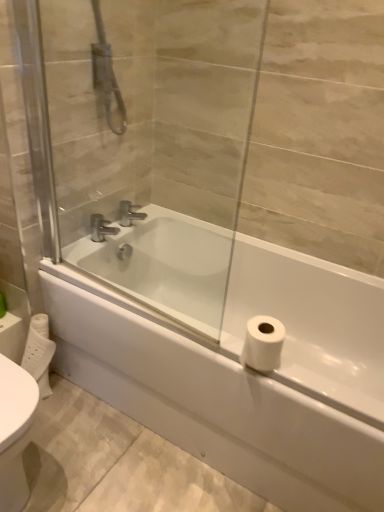
Describe the element at coordinates (231, 355) in the screenshot. I see `white glossy bathtub at center` at that location.

This screenshot has width=384, height=512. What do you see at coordinates (129, 213) in the screenshot? I see `chrome metallic faucet at upper center, which appears as the second tap when viewed from the left` at bounding box center [129, 213].

I want to click on silver metallic faucet at center, the 2th tap from the right, so point(101,228).

Identify the location of white glossy bathtub at center. (231, 355).

Can you tell me how much chrome metallic faucet at upper center, which is the first tap from right to left, and silver metallic faucet at center, marked as the 1th tap in a left-to-right arrangement, differ in facing direction?

The angle between the facing direction of chrome metallic faucet at upper center, which is the first tap from right to left, and the facing direction of silver metallic faucet at center, marked as the 1th tap in a left-to-right arrangement, is 0.00452 degrees.

Is silver metallic faucet at center, marked as the 1th tap in a left-to-right arrangement, at the back of chrome metallic faucet at upper center, which appears as the second tap when viewed from the left?

No, chrome metallic faucet at upper center, which appears as the second tap when viewed from the left,'s orientation is not away from silver metallic faucet at center, marked as the 1th tap in a left-to-right arrangement.

Between point (146, 215) and point (95, 225), which one is positioned in front?

The point (95, 225) is closer.

In the image, is chrome metallic faucet at upper center, which appears as the second tap when viewed from the left, positioned in front of or behind silver metallic faucet at center, the 2th tap from the right?

Clearly, chrome metallic faucet at upper center, which appears as the second tap when viewed from the left, is behind silver metallic faucet at center, the 2th tap from the right.

From the picture: Is silver metallic faucet at center, marked as the 1th tap in a left-to-right arrangement, at the back of transparent glass screen door at upper center?

Yes.

Which is less distant, (169, 76) or (96, 216)?

The point (169, 76) is more forward.

At what (x,y) coordinates should I click in order to perform the action: click on the 2nd tap located beneath the transparent glass screen door at upper center (from a real-world perspective). Please return your answer as a coordinate pair (x, y). The image size is (384, 512). Looking at the image, I should click on (101, 228).

Which object is positioned more to the right, transparent glass screen door at upper center or chrome metallic faucet at upper center, which appears as the second tap when viewed from the left?

transparent glass screen door at upper center.

From the image's perspective, which is above, transparent glass screen door at upper center or chrome metallic faucet at upper center, which appears as the second tap when viewed from the left?

From the image's view, transparent glass screen door at upper center is above.

Do you think transparent glass screen door at upper center is within chrome metallic faucet at upper center, which appears as the second tap when viewed from the left, or outside of it?

transparent glass screen door at upper center is outside chrome metallic faucet at upper center, which appears as the second tap when viewed from the left.

Can you confirm if transparent glass screen door at upper center is thinner than chrome metallic faucet at upper center, which is the first tap from right to left?

Yes, transparent glass screen door at upper center is thinner than chrome metallic faucet at upper center, which is the first tap from right to left.

Between point (302, 344) and point (211, 229), which one is positioned behind?

Point (211, 229)

Could you tell me if white glossy bathtub at center is facing transparent glass screen door at upper center?

No.

The height and width of the screenshot is (512, 384). In the image, there is a transparent glass screen door at upper center. In order to click on bathtub below it (from the image's perspective) in this screenshot , I will do `click(231, 355)`.

Considering the positions of objects chrome metallic faucet at upper center, which appears as the second tap when viewed from the left, and white glossy bathtub at center in the image provided, who is more to the right, chrome metallic faucet at upper center, which appears as the second tap when viewed from the left, or white glossy bathtub at center?

white glossy bathtub at center.

Considering the relative sizes of chrome metallic faucet at upper center, which is the first tap from right to left, and white glossy bathtub at center in the image provided, is chrome metallic faucet at upper center, which is the first tap from right to left, bigger than white glossy bathtub at center?

Actually, chrome metallic faucet at upper center, which is the first tap from right to left, might be smaller than white glossy bathtub at center.

Is chrome metallic faucet at upper center, which is the first tap from right to left, wider or thinner than white glossy bathtub at center?

Considering their sizes, chrome metallic faucet at upper center, which is the first tap from right to left, looks slimmer than white glossy bathtub at center.

Is point (135, 218) positioned before point (313, 370)?

That is False.

From the image's perspective, who appears lower, white glossy bathtub at center or chrome metallic faucet at upper center, which is the first tap from right to left?

white glossy bathtub at center.

Find the location of a particular element. The height and width of the screenshot is (512, 384). the 2nd tap above the white glossy bathtub at center (from the image's perspective) is located at coordinates (129, 213).

Does point (83, 282) appear closer or farther from the camera than point (128, 223)?

Clearly, point (83, 282) is closer to the camera than point (128, 223).

Which is behind, point (99, 234) or point (124, 223)?

Positioned behind is point (124, 223).

How far apart are silver metallic faucet at center, marked as the 1th tap in a left-to-right arrangement, and chrome metallic faucet at upper center, which is the first tap from right to left?

silver metallic faucet at center, marked as the 1th tap in a left-to-right arrangement, is 10.36 centimeters from chrome metallic faucet at upper center, which is the first tap from right to left.

Is silver metallic faucet at center, the 2th tap from the right, with chrome metallic faucet at upper center, which is the first tap from right to left?

They are not placed beside each other.

What's the angular difference between silver metallic faucet at center, the 2th tap from the right, and chrome metallic faucet at upper center, which is the first tap from right to left,'s facing directions?

0.00452 degrees.

Where is `tap that is above the silver metallic faucet at center, the 2th tap from the right (from the image's perspective)`? tap that is above the silver metallic faucet at center, the 2th tap from the right (from the image's perspective) is located at coordinates click(x=129, y=213).

This screenshot has height=512, width=384. I want to click on screen door above the silver metallic faucet at center, the 2th tap from the right (from a real-world perspective), so click(x=154, y=141).

When comparing their distances from transparent glass screen door at upper center, does chrome metallic faucet at upper center, which is the first tap from right to left, or white glossy bathtub at center seem further?

Among the two, chrome metallic faucet at upper center, which is the first tap from right to left, is located further to transparent glass screen door at upper center.

Based on their spatial positions, is silver metallic faucet at center, the 2th tap from the right, or chrome metallic faucet at upper center, which appears as the second tap when viewed from the left, further from white glossy bathtub at center?

chrome metallic faucet at upper center, which appears as the second tap when viewed from the left, is positioned further to the anchor white glossy bathtub at center.

Based on their spatial positions, is chrome metallic faucet at upper center, which is the first tap from right to left, or transparent glass screen door at upper center closer to white glossy bathtub at center?

The object closer to white glossy bathtub at center is transparent glass screen door at upper center.

Based on the photo, based on their spatial positions, is silver metallic faucet at center, marked as the 1th tap in a left-to-right arrangement, or transparent glass screen door at upper center further from chrome metallic faucet at upper center, which is the first tap from right to left?

transparent glass screen door at upper center lies further to chrome metallic faucet at upper center, which is the first tap from right to left, than the other object.

Looking at the image, which one is located further to silver metallic faucet at center, marked as the 1th tap in a left-to-right arrangement, transparent glass screen door at upper center or chrome metallic faucet at upper center, which appears as the second tap when viewed from the left?

transparent glass screen door at upper center lies further to silver metallic faucet at center, marked as the 1th tap in a left-to-right arrangement, than the other object.

From the image, which object appears to be farther from transparent glass screen door at upper center, silver metallic faucet at center, the 2th tap from the right, or white glossy bathtub at center?

Based on the image, silver metallic faucet at center, the 2th tap from the right, appears to be further to transparent glass screen door at upper center.

Based on their spatial positions, is white glossy bathtub at center or silver metallic faucet at center, marked as the 1th tap in a left-to-right arrangement, closer to transparent glass screen door at upper center?

white glossy bathtub at center is closer to transparent glass screen door at upper center.

Which object lies nearer to the anchor point transparent glass screen door at upper center, white glossy bathtub at center or chrome metallic faucet at upper center, which appears as the second tap when viewed from the left?

white glossy bathtub at center is closer to transparent glass screen door at upper center.

This screenshot has height=512, width=384. What are the coordinates of `bathtub between transparent glass screen door at upper center and chrome metallic faucet at upper center, which is the first tap from right to left, in the front-back direction` in the screenshot? It's located at (231, 355).

Identify the location of tap located between white glossy bathtub at center and chrome metallic faucet at upper center, which appears as the second tap when viewed from the left, in the depth direction. pyautogui.click(x=101, y=228).

This screenshot has height=512, width=384. I want to click on bathtub between transparent glass screen door at upper center and silver metallic faucet at center, the 2th tap from the right, in the front-back direction, so click(231, 355).

Where is `tap between transparent glass screen door at upper center and chrome metallic faucet at upper center, which appears as the second tap when viewed from the left, from front to back`? The width and height of the screenshot is (384, 512). tap between transparent glass screen door at upper center and chrome metallic faucet at upper center, which appears as the second tap when viewed from the left, from front to back is located at coordinates [x=101, y=228].